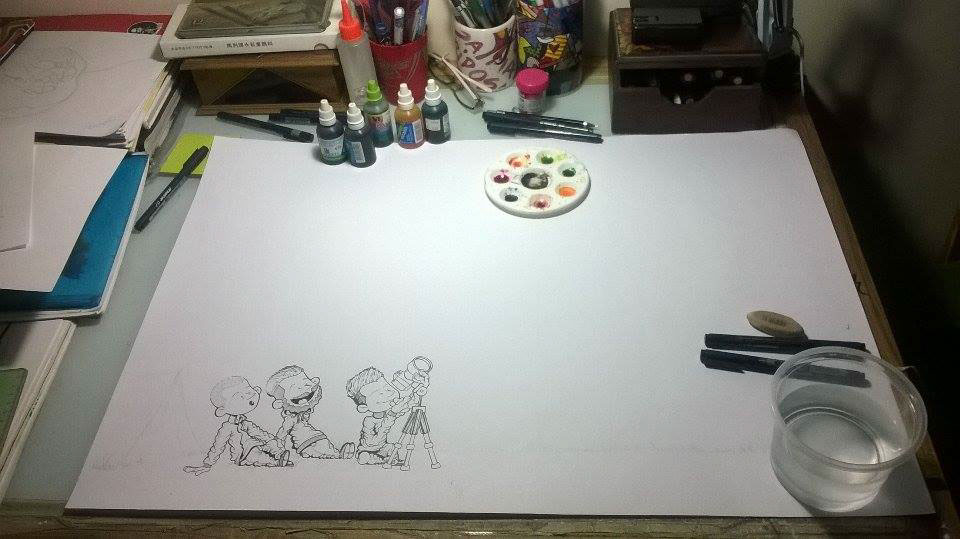
This screenshot has height=539, width=960. Find the location of `wooden desk/table`. wooden desk/table is located at coordinates (800, 127).